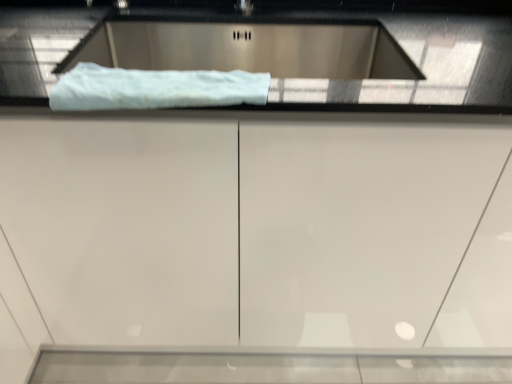
What are the coordinates of `empty space that is ontop of white fluffy towel at upper center (from a real-world perspective)` in the screenshot? It's located at (170, 77).